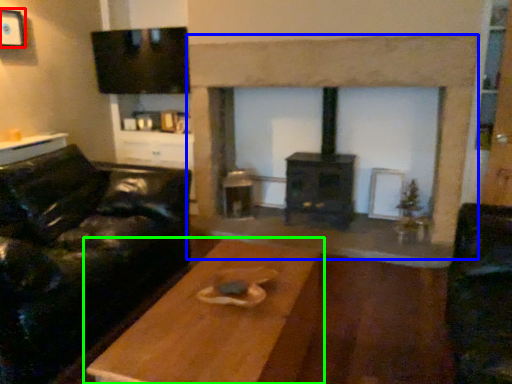
Question: Considering the real-world distances, which object is closest to picture frame (highlighted by a red box)? fireplace (highlighted by a blue box) or table (highlighted by a green box).

Choices:
 (A) fireplace
 (B) table

Answer: (A)